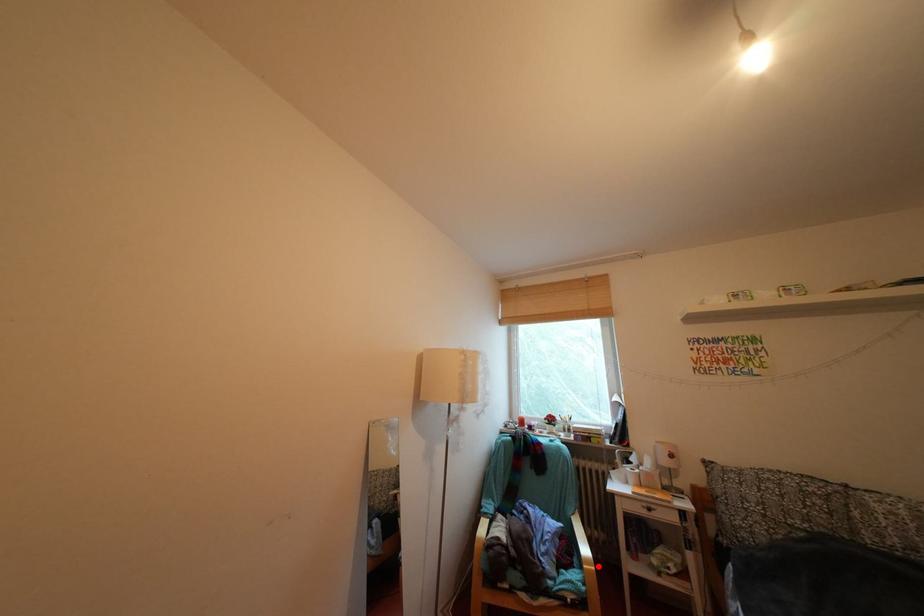
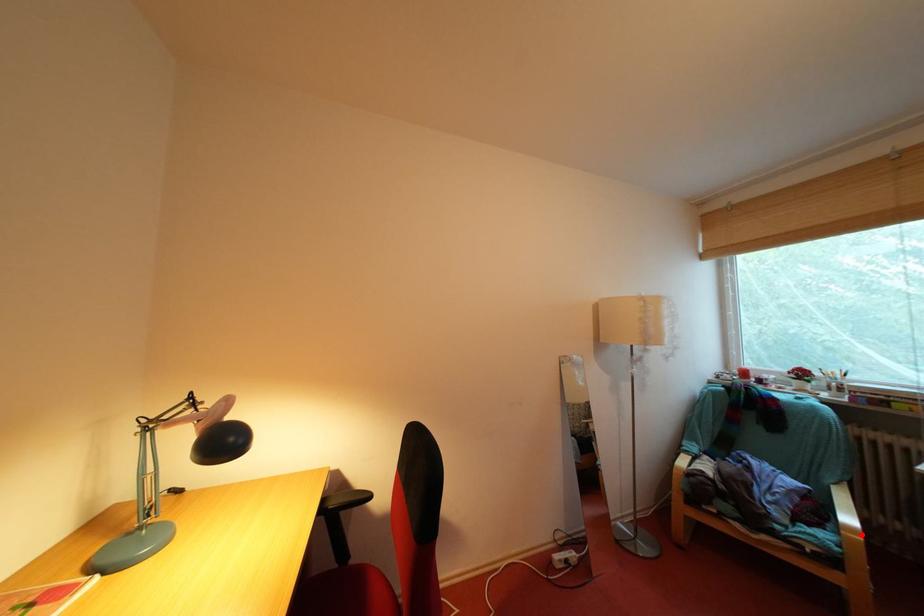
I am providing you with two images of the same scene from different viewpoints. A red point is marked on the first image and another point is marked on the second image. Does the point marked in image1 correspond to the same location as the one in image2?

Yes